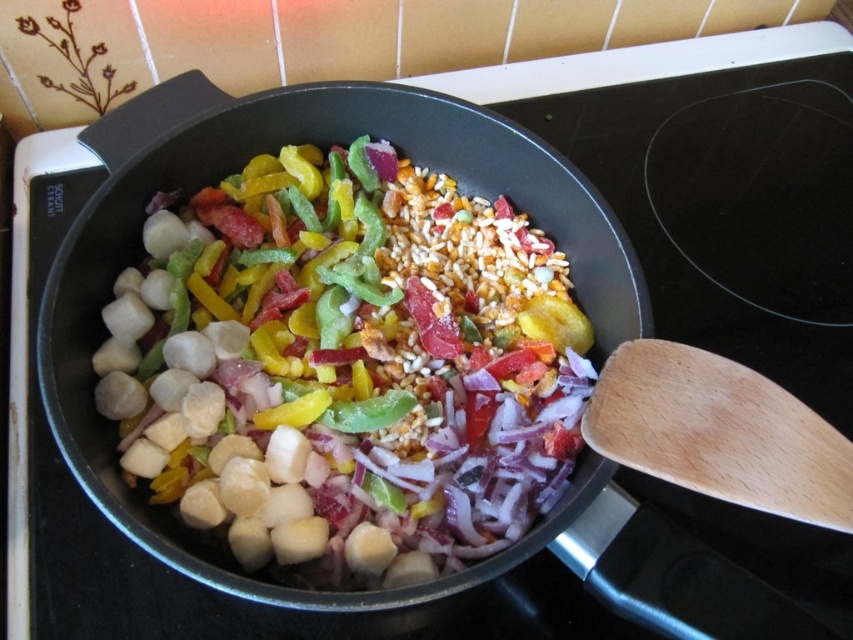
Question: Which of the following is the farthest from the observer?

Choices:
 (A) shiny metallic scallops at center
 (B) wooden spatula at right

Answer: (A)

Question: Is shiny metallic scallops at center below wooden spatula at right?

Choices:
 (A) no
 (B) yes

Answer: (A)

Question: Is shiny metallic scallops at center thinner than wooden spatula at right?

Choices:
 (A) no
 (B) yes

Answer: (A)

Question: Does shiny metallic scallops at center appear under wooden spatula at right?

Choices:
 (A) yes
 (B) no

Answer: (B)